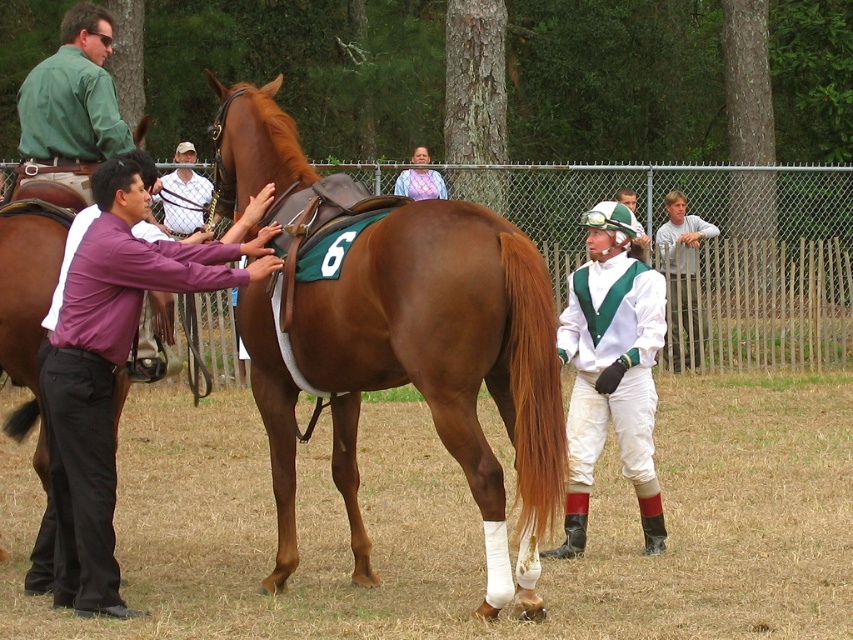
You are a photographer at the horse racing event. You need to capture a photo of the white matte vest at center and green smooth shirt at upper left. Which one will appear closer to the camera in the photo?

The white matte vest at center will appear closer to the camera in the photo because it is in front of the green smooth shirt at upper left.

You are a fashion designer observing the jockey at a horse racing event. You notice the jockey is wearing both the white matte pants at center and the white matte vest at center. Can you determine if the distance between these two clothing items on the jockey is sufficient for attaching a decorative pin that requires 1.5 meters of space between them?

The white matte pants at center and white matte vest at center are 1.84 meters apart, which is more than enough space for the decorative pin that requires 1.5 meters of separation between them.

From the picture: You are a photographer at the horse racing event. You need to capture a photo of the brown horse with the green saddle cloth and the jockey in white outfit with green accents. However, there is an object blocking the view at point (x=115, y=364). What is the object blocking the view?

The object blocking the view at point (x=115, y=364) is the white matte pants at center.